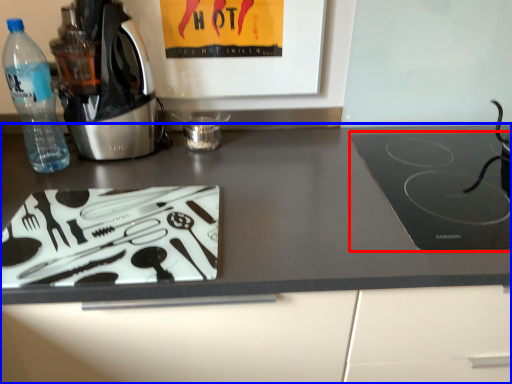
Question: Which of the following is the farthest to the observer, kitchen appliance (highlighted by a red box) or countertop (highlighted by a blue box)?

Choices:
 (A) kitchen appliance
 (B) countertop

Answer: (A)